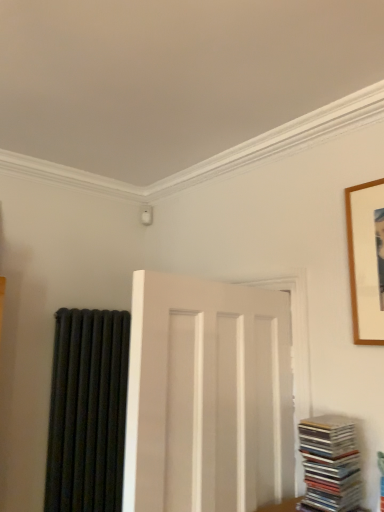
Question: Is wooden picture frame at upper right inside or outside of black matte radiator at left?

Choices:
 (A) inside
 (B) outside

Answer: (B)

Question: Would you say wooden picture frame at upper right is to the left or to the right of black matte radiator at left in the picture?

Choices:
 (A) right
 (B) left

Answer: (A)

Question: Which is nearer to the wooden picture frame at upper right?

Choices:
 (A) white matte door at center
 (B) stacked glossy cds at lower right
 (C) black matte radiator at left

Answer: (B)

Question: Estimate the real-world distances between objects in this image. Which object is farther from the wooden picture frame at upper right?

Choices:
 (A) white matte door at center
 (B) black matte radiator at left
 (C) stacked glossy cds at lower right

Answer: (B)